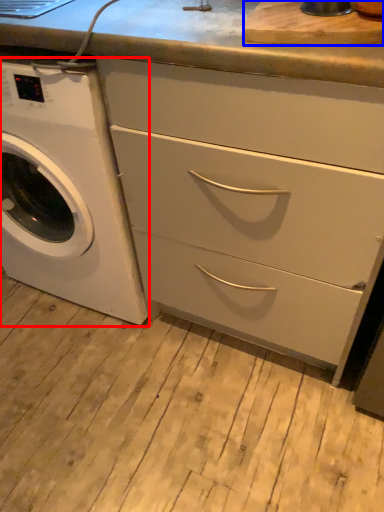
Question: Which point is closer to the camera, washing machine (highlighted by a red box) or cutting board (highlighted by a blue box)?

Choices:
 (A) washing machine
 (B) cutting board

Answer: (B)